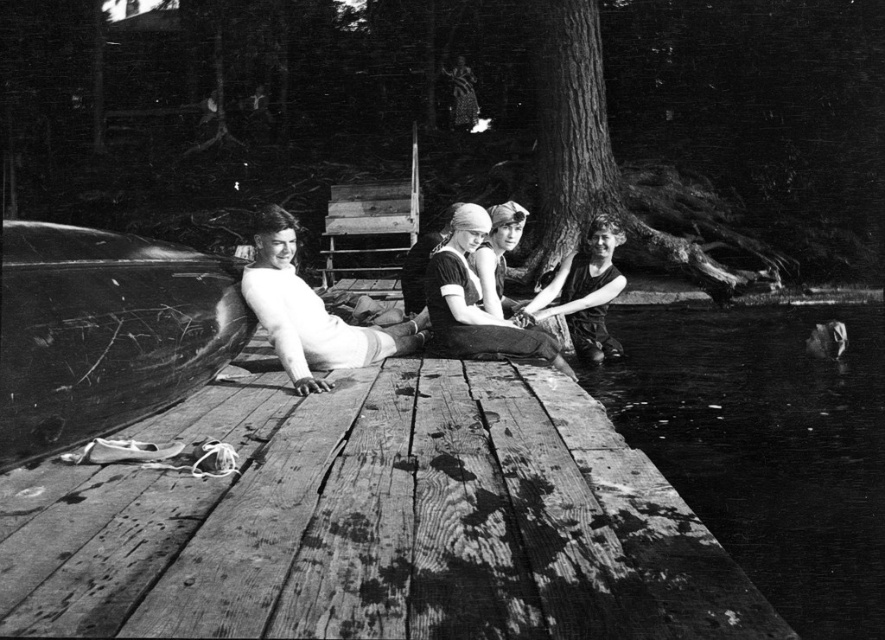
Is point (590, 353) closer to camera compared to point (495, 243)?

That is False.

Describe the element at coordinates (583, 291) in the screenshot. I see `matte black swimsuit at center` at that location.

Is point (589, 234) positioned behind point (483, 289)?

Yes, point (589, 234) is farther from viewer.

Where is `matte black swimsuit at center`? The width and height of the screenshot is (885, 640). matte black swimsuit at center is located at coordinates pyautogui.click(x=583, y=291).

Between point (316, 349) and point (602, 234), which one is positioned behind?

The point (602, 234) is behind.

The width and height of the screenshot is (885, 640). What are the coordinates of `smooth white skin at center` in the screenshot? It's located at (312, 312).

Does dark water at lower right appear on the right side of matte black swimsuit at center?

Yes, dark water at lower right is to the right of matte black swimsuit at center.

Which is behind, point (879, 316) or point (568, 282)?

Positioned behind is point (879, 316).

Is point (847, 355) farther from viewer compared to point (587, 353)?

That is True.

Find the location of a particular element. The width and height of the screenshot is (885, 640). dark water at lower right is located at coordinates (766, 445).